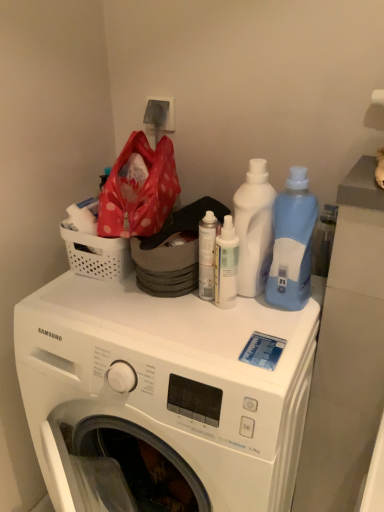
This screenshot has height=512, width=384. In order to click on vacant area that is in front of white plastic bottle at center, positioned as the second cleaning product in right-to-left order in this screenshot , I will do `click(243, 330)`.